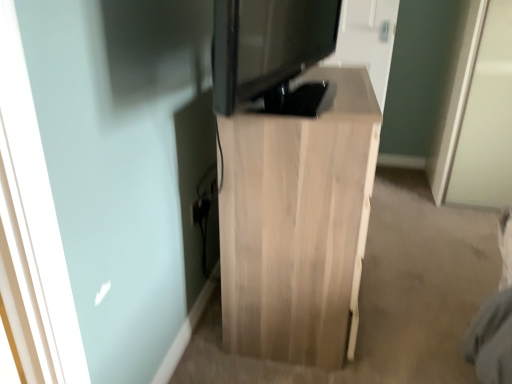
From the picture: Measure the distance between point (253, 246) and camera.

Point (253, 246) and camera are 1.30 meters apart from each other.

The image size is (512, 384). What do you see at coordinates (297, 224) in the screenshot? I see `light wood cabinet at center` at bounding box center [297, 224].

What is the approximate width of light wood cabinet at center?

light wood cabinet at center is 19.89 inches in width.

Locate an element on the screen. light wood cabinet at center is located at coordinates (297, 224).

Identify the location of matte black monitor at center. This screenshot has height=384, width=512. (267, 46).

The image size is (512, 384). What do you see at coordinates (267, 46) in the screenshot? I see `matte black monitor at center` at bounding box center [267, 46].

Where is `light wood cabinet at center`? The image size is (512, 384). light wood cabinet at center is located at coordinates (297, 224).

Between light wood cabinet at center and matte black monitor at center, which one appears on the right side from the viewer's perspective?

From the viewer's perspective, light wood cabinet at center appears more on the right side.

Relative to matte black monitor at center, is light wood cabinet at center in front or behind?

light wood cabinet at center is positioned farther from the viewer than matte black monitor at center.

Between point (259, 149) and point (236, 47), which one is positioned in front?

The point (236, 47) is closer.

From the image's perspective, would you say light wood cabinet at center is shown under matte black monitor at center?

Indeed, from the image's perspective, light wood cabinet at center is shown beneath matte black monitor at center.

From a real-world perspective, which is physically above, light wood cabinet at center or matte black monitor at center?

matte black monitor at center, from a real-world perspective.

Is light wood cabinet at center wider or thinner than matte black monitor at center?

Considering their sizes, light wood cabinet at center looks broader than matte black monitor at center.

Can you confirm if light wood cabinet at center is shorter than matte black monitor at center?

In fact, light wood cabinet at center may be taller than matte black monitor at center.

In terms of size, does light wood cabinet at center appear bigger or smaller than matte black monitor at center?

In the image, light wood cabinet at center appears to be larger than matte black monitor at center.

Is light wood cabinet at center positioned beyond the bounds of matte black monitor at center?

Yes, light wood cabinet at center is not within matte black monitor at center.

Is light wood cabinet at center placed right next to matte black monitor at center?

They are not placed beside each other.

Could you tell me if light wood cabinet at center is facing matte black monitor at center?

No, light wood cabinet at center is not aimed at matte black monitor at center.

How different are the orientations of light wood cabinet at center and matte black monitor at center in degrees?

There is a 7.81-degree angle between the facing directions of light wood cabinet at center and matte black monitor at center.

Measure the distance from light wood cabinet at center to matte black monitor at center.

light wood cabinet at center is 14.22 inches away from matte black monitor at center.

Find the location of `furniture beneath the matte black monitor at center (from a real-world perspective)`. furniture beneath the matte black monitor at center (from a real-world perspective) is located at coordinates (297, 224).

Considering the positions of objects matte black monitor at center and light wood cabinet at center in the image provided, who is more to the left, matte black monitor at center or light wood cabinet at center?

matte black monitor at center is more to the left.

Between matte black monitor at center and light wood cabinet at center, which one is positioned in front?

matte black monitor at center is closer to the camera.

Is point (246, 55) closer to camera compared to point (313, 298)?

Yes, it is in front of point (313, 298).

From the image's perspective, is matte black monitor at center positioned above or below light wood cabinet at center?

matte black monitor at center is above light wood cabinet at center.

From a real-world perspective, does matte black monitor at center sit lower than light wood cabinet at center?

Incorrect, from a real-world perspective, matte black monitor at center is higher than light wood cabinet at center.

Can you confirm if matte black monitor at center is thinner than light wood cabinet at center?

Yes, matte black monitor at center is thinner than light wood cabinet at center.

Considering the relative sizes of matte black monitor at center and light wood cabinet at center in the image provided, is matte black monitor at center taller than light wood cabinet at center?

No, matte black monitor at center is not taller than light wood cabinet at center.

Between matte black monitor at center and light wood cabinet at center, which one has smaller size?

With smaller size is matte black monitor at center.

Is matte black monitor at center not inside light wood cabinet at center?

That's correct, matte black monitor at center is outside of light wood cabinet at center.

Are matte black monitor at center and light wood cabinet at center beside each other?

No.

Could you tell me if matte black monitor at center is facing light wood cabinet at center?

No, matte black monitor at center is not turned towards light wood cabinet at center.

What's the angular difference between matte black monitor at center and light wood cabinet at center's facing directions?

7.81 degrees.

Find the location of a particular element. This screenshot has width=512, height=384. electronic on the left of the light wood cabinet at center is located at coordinates (267, 46).

Where is `furniture behind the matte black monitor at center`? furniture behind the matte black monitor at center is located at coordinates (297, 224).

Locate an element on the screen. The width and height of the screenshot is (512, 384). electronic that is above the light wood cabinet at center (from the image's perspective) is located at coordinates (267, 46).